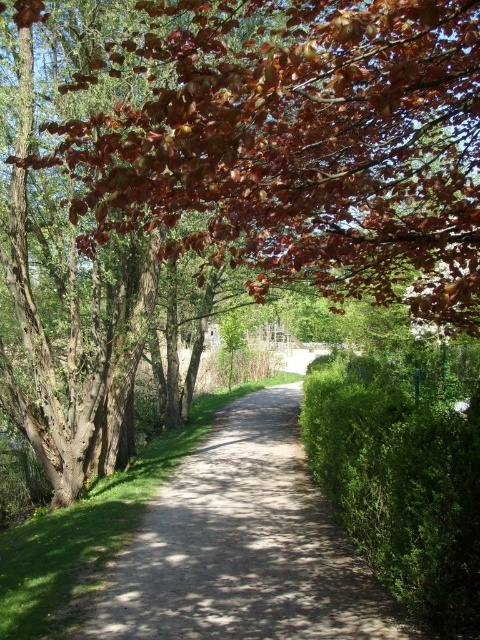
Question: Which of the following is the closest to the observer?

Choices:
 (A) green leafy hedge at right
 (B) brown leafy tree at upper left
 (C) dirt/gravel path at center

Answer: (B)

Question: Which point appears farthest from the camera in this image?

Choices:
 (A) (228, 547)
 (B) (429, 458)

Answer: (A)

Question: Is the position of brown leafy tree at upper left more distant than that of green leafy hedge at right?

Choices:
 (A) no
 (B) yes

Answer: (A)

Question: Where is dirt/gravel path at center located in relation to green leafy hedge at right in the image?

Choices:
 (A) left
 (B) right

Answer: (A)

Question: Which point is closer to the camera?

Choices:
 (A) brown leafy tree at upper left
 (B) dirt/gravel path at center

Answer: (A)

Question: Does brown leafy tree at upper left come in front of dirt/gravel path at center?

Choices:
 (A) yes
 (B) no

Answer: (A)